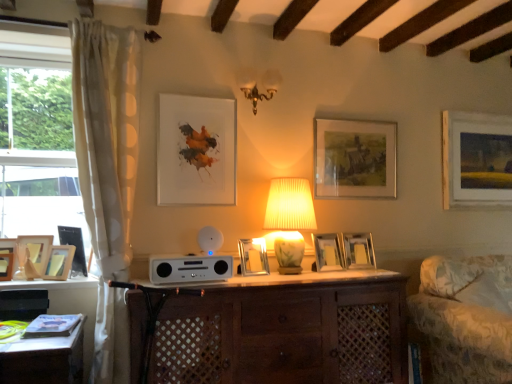
Question: Is patterned fabric swivel chair at right bigger than white dotted fabric curtain at left?

Choices:
 (A) no
 (B) yes

Answer: (B)

Question: Is white dotted fabric curtain at left inside patterned fabric swivel chair at right?

Choices:
 (A) no
 (B) yes

Answer: (A)

Question: Can you confirm if patterned fabric swivel chair at right is positioned to the right of white dotted fabric curtain at left?

Choices:
 (A) yes
 (B) no

Answer: (A)

Question: Considering the relative sizes of patterned fabric swivel chair at right and white dotted fabric curtain at left in the image provided, is patterned fabric swivel chair at right thinner than white dotted fabric curtain at left?

Choices:
 (A) no
 (B) yes

Answer: (A)

Question: Is patterned fabric swivel chair at right turned away from white dotted fabric curtain at left?

Choices:
 (A) no
 (B) yes

Answer: (A)

Question: Can you confirm if patterned fabric swivel chair at right is smaller than white dotted fabric curtain at left?

Choices:
 (A) no
 (B) yes

Answer: (A)

Question: Is brown wooden cabinet at center taller than wooden picture frame at left, which is the first picture frame from left to right?

Choices:
 (A) yes
 (B) no

Answer: (A)

Question: Does brown wooden cabinet at center come behind wooden picture frame at left, which is the first picture frame from left to right?

Choices:
 (A) no
 (B) yes

Answer: (A)

Question: Is brown wooden cabinet at center not within wooden picture frame at left, the 10th picture frame from the right?

Choices:
 (A) yes
 (B) no

Answer: (A)

Question: From the image's perspective, is brown wooden cabinet at center under wooden picture frame at left, the 10th picture frame from the right?

Choices:
 (A) no
 (B) yes

Answer: (B)

Question: Would you say brown wooden cabinet at center is a long distance from wooden picture frame at left, the 10th picture frame from the right?

Choices:
 (A) no
 (B) yes

Answer: (B)

Question: Is brown wooden cabinet at center wider than wooden picture frame at left, which is the first picture frame from left to right?

Choices:
 (A) yes
 (B) no

Answer: (A)

Question: Is wooden picture frame at left, acting as the third picture frame starting from the left, not inside wooden picture frame at left, the 10th picture frame from the right?

Choices:
 (A) yes
 (B) no

Answer: (A)